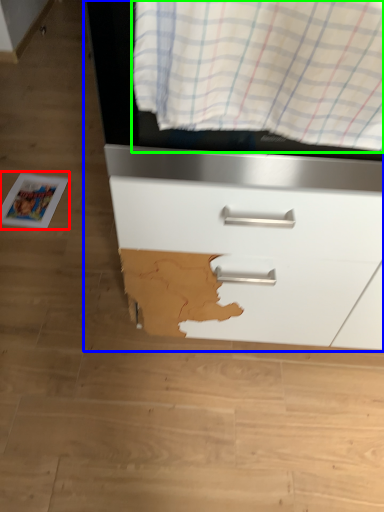
Question: Estimate the real-world distances between objects in this image. Which object is farther from magazine (highlighted by a red box), chest of drawers (highlighted by a blue box) or curtain (highlighted by a green box)?

Choices:
 (A) chest of drawers
 (B) curtain

Answer: (B)